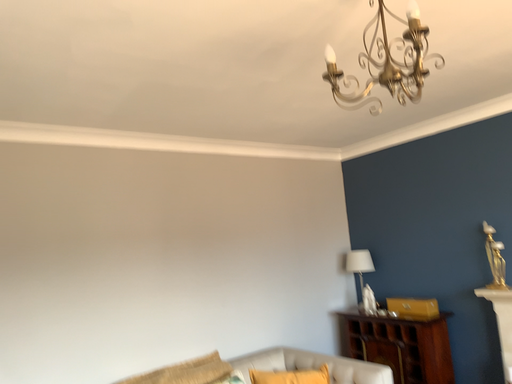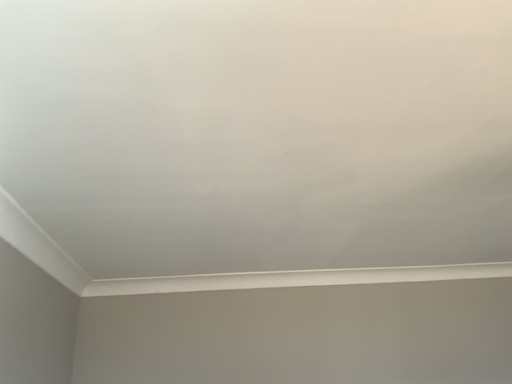
Question: Which way did the camera rotate in the video?

Choices:
 (A) rotated downward
 (B) rotated upward

Answer: (B)